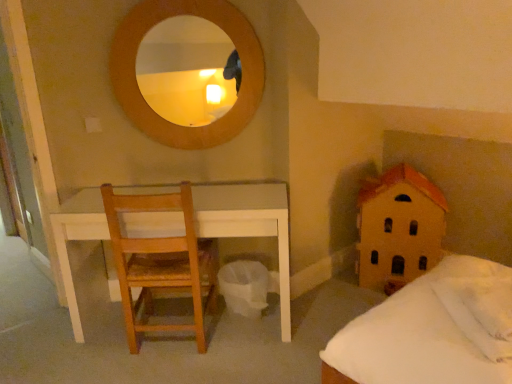
This screenshot has width=512, height=384. I want to click on free space above white fluffy pillow at lower right, which ranks as the 2th pillow in front-to-back order (from a real-world perspective), so [494, 299].